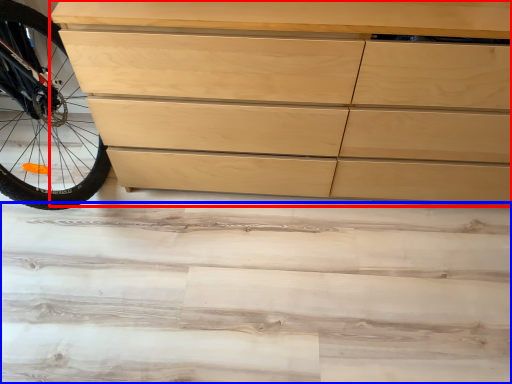
Question: Which object appears closest to the camera in this image, chest of drawers (highlighted by a red box) or stair (highlighted by a blue box)?

Choices:
 (A) chest of drawers
 (B) stair

Answer: (A)